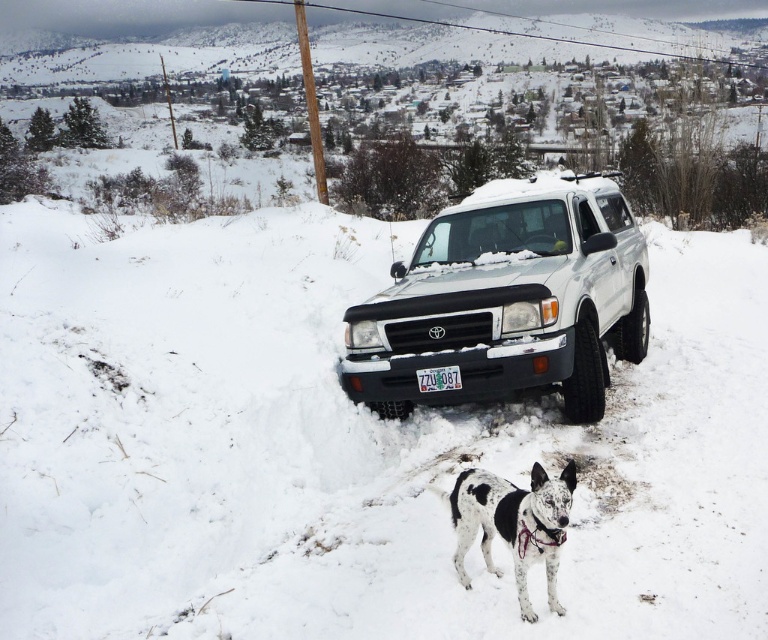
You are a delivery driver who needs to load packages into the trunk of the white matte suv at center. However, there is a spotted fur dog at center blocking the trunk. Can you easily move the dog to access the trunk?

The white matte suv at center is larger than the spotted fur dog at center, so you can easily move the dog to access the trunk.

In the scene shown: You are a delivery driver who needs to attach a large package to the roof of the white matte suv at center. Considering the size of the white plastic license plate at center, will the package block the license plate from being visible?

The white matte suv at center is larger than the white plastic license plate at center, so the large package attached to the roof of the white matte suv at center would not block the license plate from being visible.